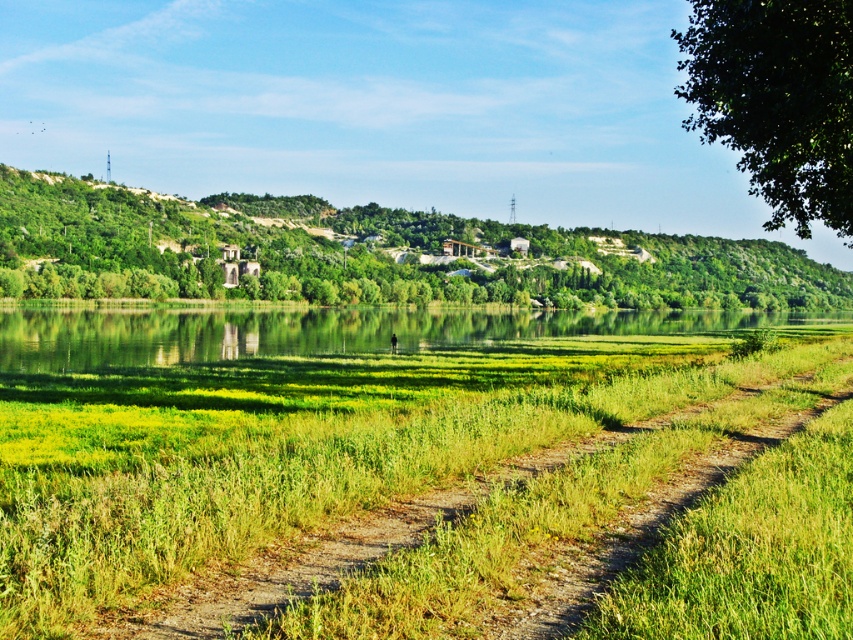
You are standing at the edge of the dirt path and want to walk towards the water. Which area, the green grassy at center or the green leafy hill at upper center, do you think you can walk through more easily?

Result: The green grassy at center has a lesser width compared to the green leafy hill at upper center, so it might be narrower and potentially harder to walk through. The green leafy hill at upper center is wider, making it easier to navigate.

You are standing at the edge of the dirt path and want to walk towards the green leafy hill at upper center. Which direction should you walk relative to the green grassy at center?

You should walk towards the upper direction relative to the green grassy at center because the green leafy hill at upper center is located above it.

You are a hiker who wants to take a photo of the green leafy hill at upper center from the green grassy at center. Can you see the entire hill from there?

The green grassy at center is not as tall as the green leafy hill at upper center, so you can see the entire hill from there because the grassy area is lower in height.